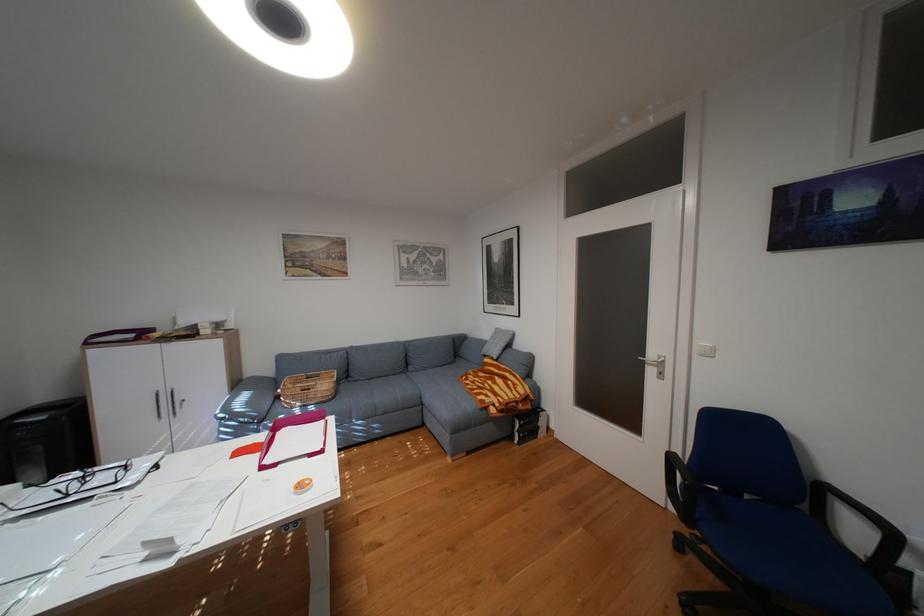
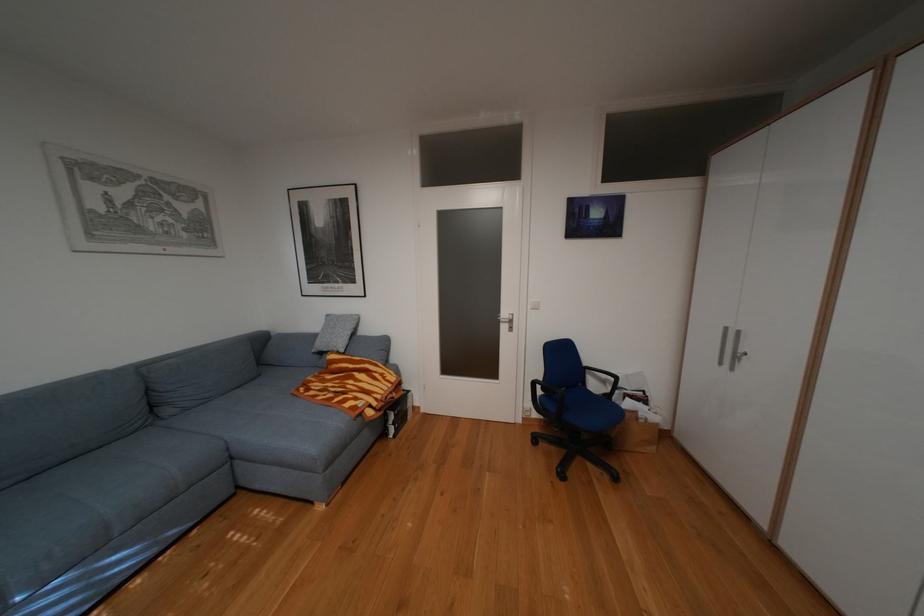
Question: How did the camera likely rotate?

Choices:
 (A) Left
 (B) Right
 (C) Up
 (D) Down

Answer: (B)